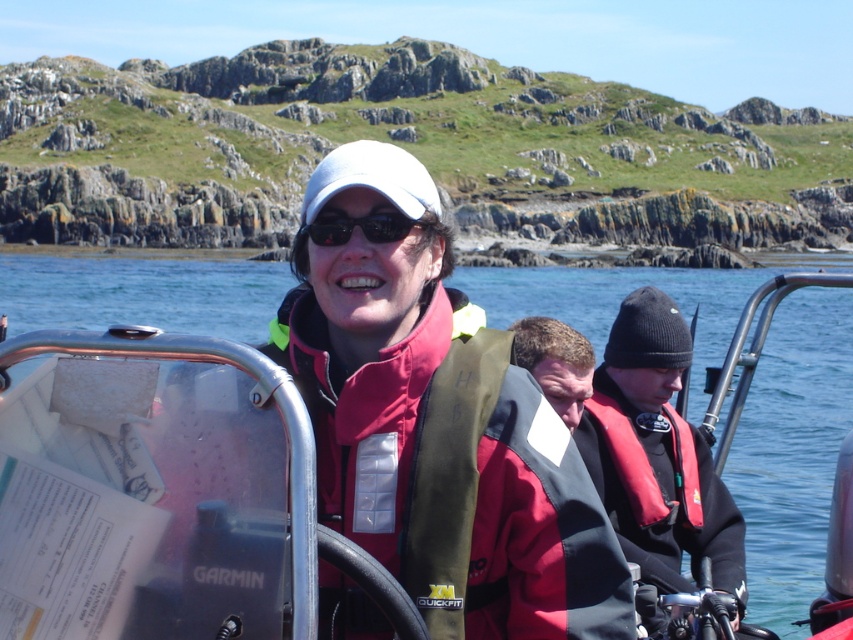
Question: Which point is closer to the camera?

Choices:
 (A) 647,493
 (B) 334,516
 (C) 654,413

Answer: (B)

Question: Does red life jacket at center have a lesser width compared to red matte life jacket at right?

Choices:
 (A) no
 (B) yes

Answer: (A)

Question: Which point is farther from the camera taking this photo?

Choices:
 (A) (766, 378)
 (B) (390, 561)

Answer: (A)

Question: Which of the following is the closest to the observer?

Choices:
 (A) red matte life jacket at right
 (B) red life vest at center

Answer: (B)

Question: Is metallic silver boat at center further to the viewer compared to red life vest at center?

Choices:
 (A) no
 (B) yes

Answer: (B)

Question: From the image, what is the correct spatial relationship of red life vest at center in relation to dark brown hair at center?

Choices:
 (A) right
 (B) left

Answer: (A)